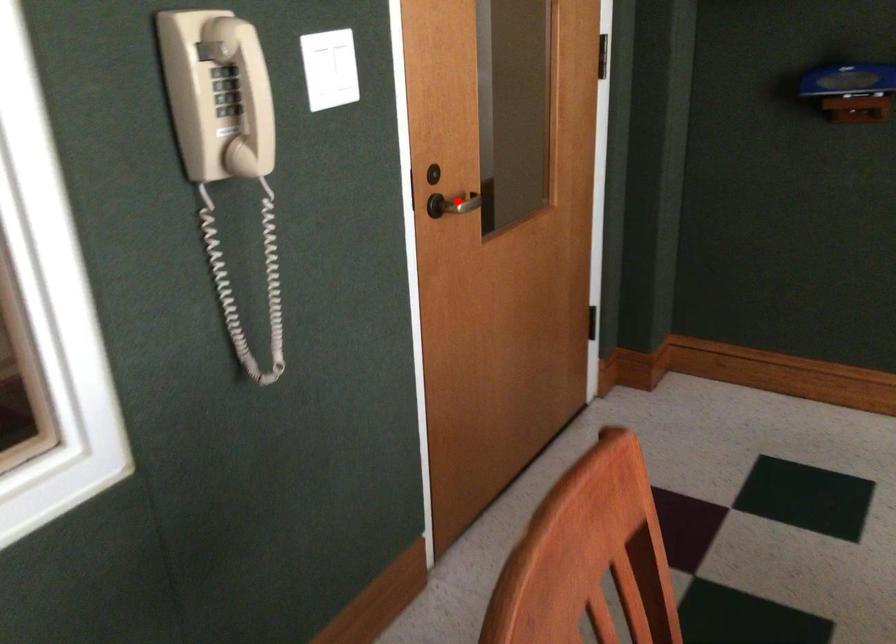
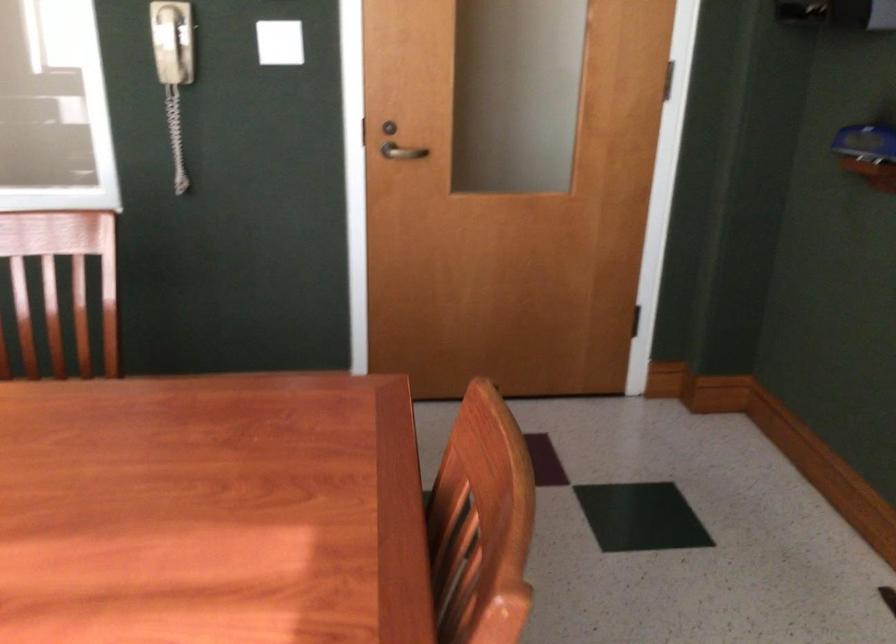
Question: I am providing you with two images of the same scene from different viewpoints. Given a red point in image1, look at the same physical point in image2. Is it:

Choices:
 (A) Closer to the viewpoint
 (B) Farther from the viewpoint

Answer: (B)